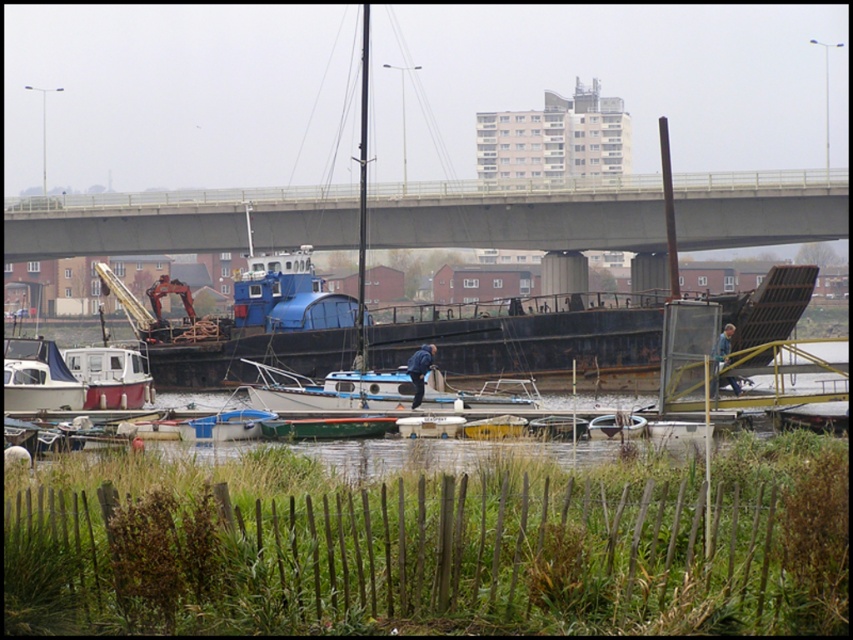
Can you confirm if white matte sailboat at center is thinner than white matte sailboat at lower left?

No.

Does white matte sailboat at center have a larger size compared to white matte sailboat at lower left?

Yes, white matte sailboat at center is bigger than white matte sailboat at lower left.

This screenshot has height=640, width=853. What are the coordinates of `white matte sailboat at center` in the screenshot? It's located at (329, 388).

Is point (70, 211) positioned before point (10, 349)?

No, (70, 211) is behind (10, 349).

This screenshot has width=853, height=640. Describe the element at coordinates (178, 221) in the screenshot. I see `gray concrete bridge at upper center` at that location.

Which is behind, point (709, 241) or point (68, 388)?

The point (709, 241) is more distant.

Find the location of a particular element. gray concrete bridge at upper center is located at coordinates (178, 221).

Consider the image. Is gray concrete bridge at upper center smaller than white matte sailboat at center?

No.

Does gray concrete bridge at upper center appear over white matte sailboat at center?

Yes.

What do you see at coordinates (178, 221) in the screenshot?
I see `gray concrete bridge at upper center` at bounding box center [178, 221].

Find the location of a particular element. This screenshot has width=853, height=640. gray concrete bridge at upper center is located at coordinates click(178, 221).